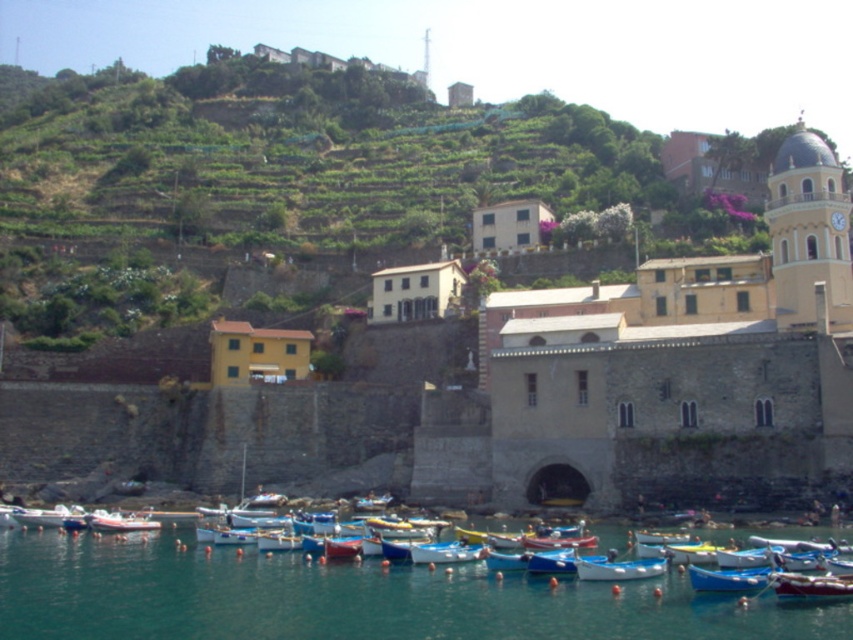
Question: Is blue glossy boat at center positioned at the back of white plastic boat at lower left?

Choices:
 (A) yes
 (B) no

Answer: (B)

Question: Which point is farther to the camera?

Choices:
 (A) blue painted wooden boat at lower center
 (B) blue plastic boat at lower center
 (C) clear blue water at lower center
 (D) white plastic boat at lower left

Answer: (D)

Question: From the image, what is the correct spatial relationship of blue glossy boat at center in relation to white plastic boat at lower left?

Choices:
 (A) above
 (B) below

Answer: (A)

Question: Which of the following is the farthest from the observer?

Choices:
 (A) (809, 586)
 (B) (109, 522)

Answer: (B)

Question: Does wooden boat at lower right lie in front of blue plastic boat at lower center?

Choices:
 (A) yes
 (B) no

Answer: (A)

Question: Which point is closer to the camera?

Choices:
 (A) (107, 525)
 (B) (625, 570)
 (C) (705, 580)

Answer: (C)